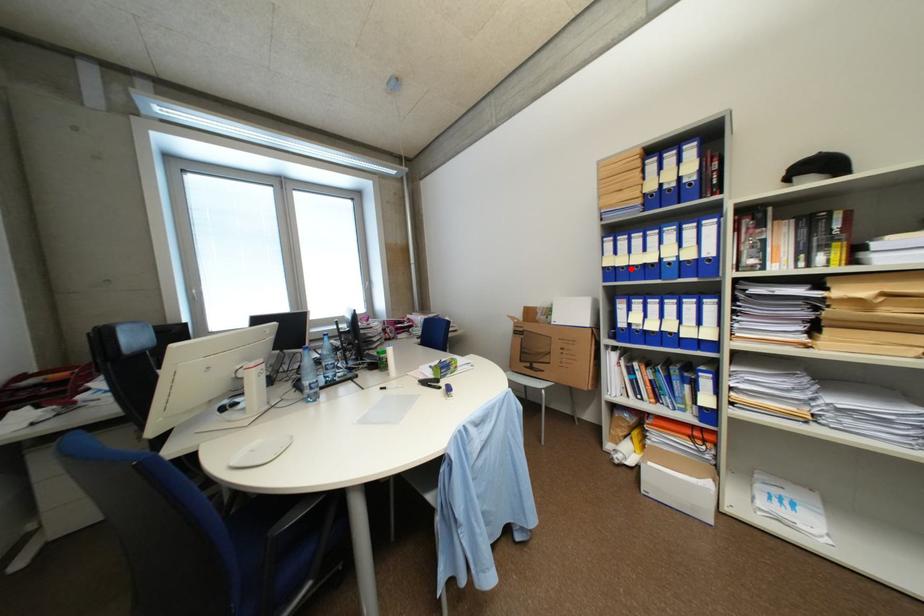
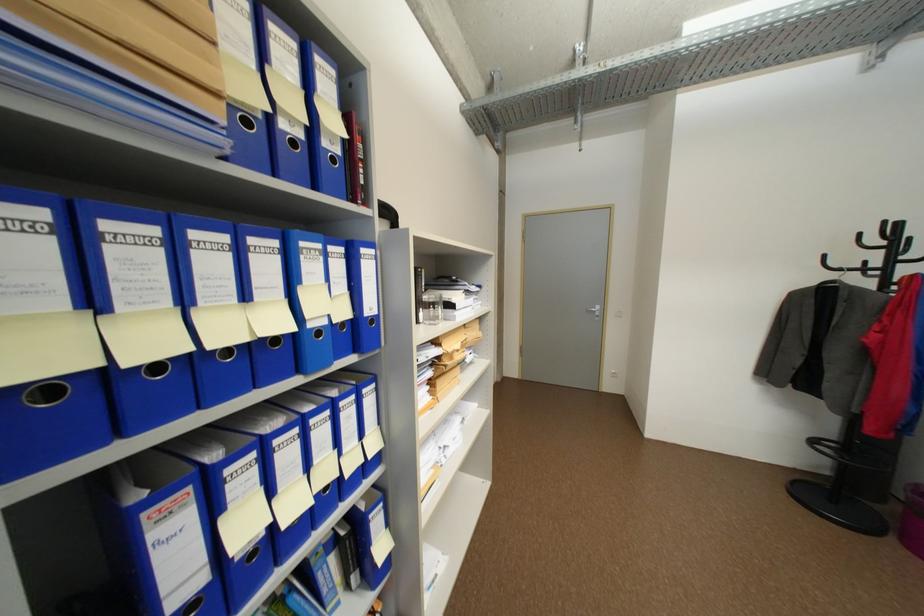
Locate, in the second image, the point that corresponds to the highlighted location in the first image.

(164, 368)